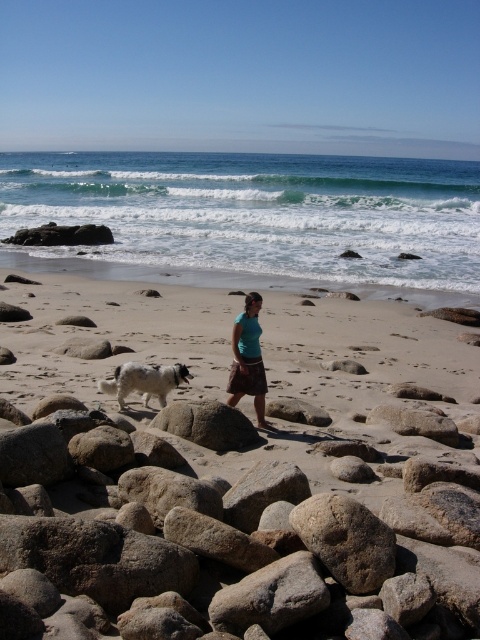
Question: Is sandy beach at lower center closer to the viewer compared to smooth gray rock at center?

Choices:
 (A) yes
 (B) no

Answer: (B)

Question: Among these objects, which one is nearest to the camera?

Choices:
 (A) teal fabric skirt at center
 (B) smooth sand beach at center
 (C) white fluffy dog at center
 (D) sandy beach at lower center

Answer: (B)

Question: Which object is the closest to the smooth sand beach at center?

Choices:
 (A) smooth gray rock at center
 (B) white fluffy dog at center

Answer: (A)

Question: Is smooth sand beach at center bigger than smooth gray rock at center?

Choices:
 (A) yes
 (B) no

Answer: (A)

Question: Which of the following is the closest to the observer?

Choices:
 (A) smooth sand beach at center
 (B) white fluffy dog at center

Answer: (A)

Question: Is sandy beach at lower center further to camera compared to teal fabric skirt at center?

Choices:
 (A) no
 (B) yes

Answer: (B)